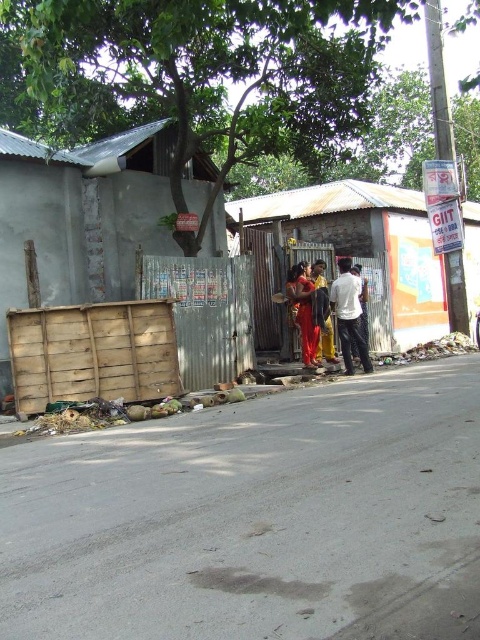
Question: Can you confirm if wooden fence at left is wider than white matte shirt at center?

Choices:
 (A) no
 (B) yes

Answer: (B)

Question: Which of the following is the closest to the observer?

Choices:
 (A) wooden fence at left
 (B) white matte shirt at center
 (C) matte red dress at center

Answer: (B)

Question: Estimate the real-world distances between objects in this image. Which object is farther from the matte red dress at center?

Choices:
 (A) white matte shirt at center
 (B) wooden fence at left
 (C) metallic corrugated hut at center

Answer: (C)

Question: Does wooden fence at left appear on the right side of metallic corrugated hut at center?

Choices:
 (A) no
 (B) yes

Answer: (A)

Question: Does metallic corrugated hut at center appear over matte red dress at center?

Choices:
 (A) no
 (B) yes

Answer: (B)

Question: Which point is farther to the camera?

Choices:
 (A) (429, 298)
 (B) (344, 260)
 (C) (296, 288)

Answer: (A)